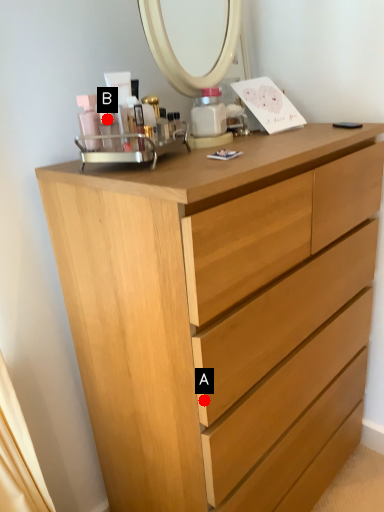
Question: Two points are circled on the image, labeled by A and B beside each circle. Which point appears farthest from the camera in this image?

Choices:
 (A) A is further
 (B) B is further

Answer: (B)